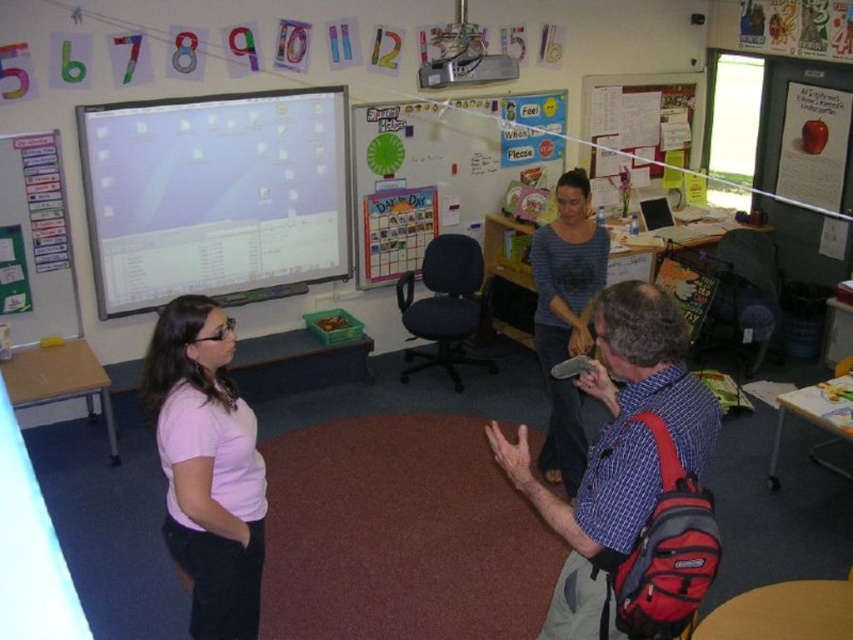
You are standing in the classroom and want to move from one point to another. If you start at point (670,422) and walk towards point (566,461), will you be moving closer to or farther from the window on the right side of the room?

Since point (670,422) is closer to the viewer than point (566,461), moving from the first point to the second would mean you are moving farther away from the window on the right side of the room.